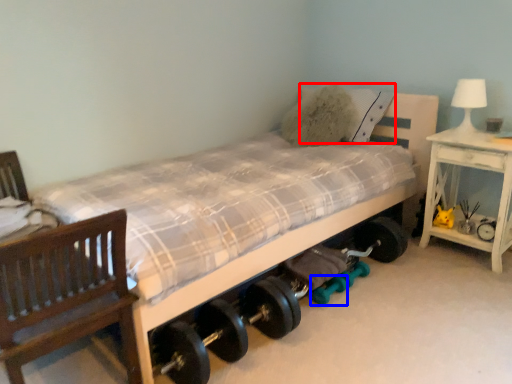
Question: Which object appears farthest to the camera in this image, pillow (highlighted by a red box) or dumbbell (highlighted by a blue box)?

Choices:
 (A) pillow
 (B) dumbbell

Answer: (A)